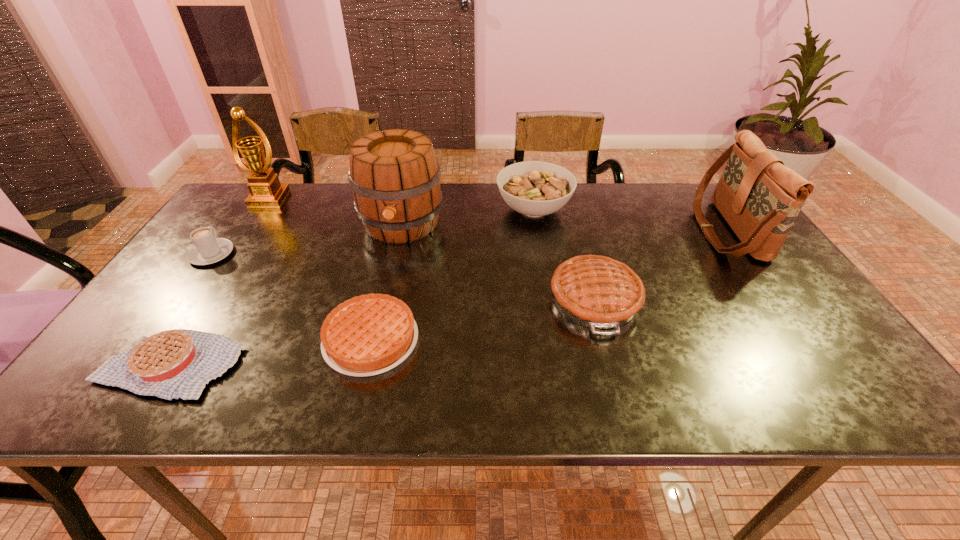
Identify the location of free space located 0.120m on the side of the cider where the spigot is located. (389, 281).

Where is `free space located on the front-facing side of the shoulder bag`? This screenshot has width=960, height=540. free space located on the front-facing side of the shoulder bag is located at coordinates (625, 230).

The height and width of the screenshot is (540, 960). I want to click on free point located 0.380m on the front-facing side of the shoulder bag, so click(570, 230).

Identify the location of free point located on the front-facing side of the shoulder bag. This screenshot has width=960, height=540. (564, 230).

Where is `free region located on the left of the stew`? free region located on the left of the stew is located at coordinates (480, 210).

Where is `vacant space located 0.370m on the back of the rightmost pie`? The image size is (960, 540). vacant space located 0.370m on the back of the rightmost pie is located at coordinates (565, 193).

This screenshot has height=540, width=960. In order to click on vacant space located to the right of the cappuccino in this screenshot , I will do `click(243, 210)`.

Identify the location of vacant space located to the right of the cappuccino. (239, 215).

In order to click on vacant space located to the right of the cappuccino in this screenshot , I will do `click(241, 213)`.

Locate an element on the screen. Image resolution: width=960 pixels, height=540 pixels. free location located on the back of the second pie from right to left is located at coordinates (391, 256).